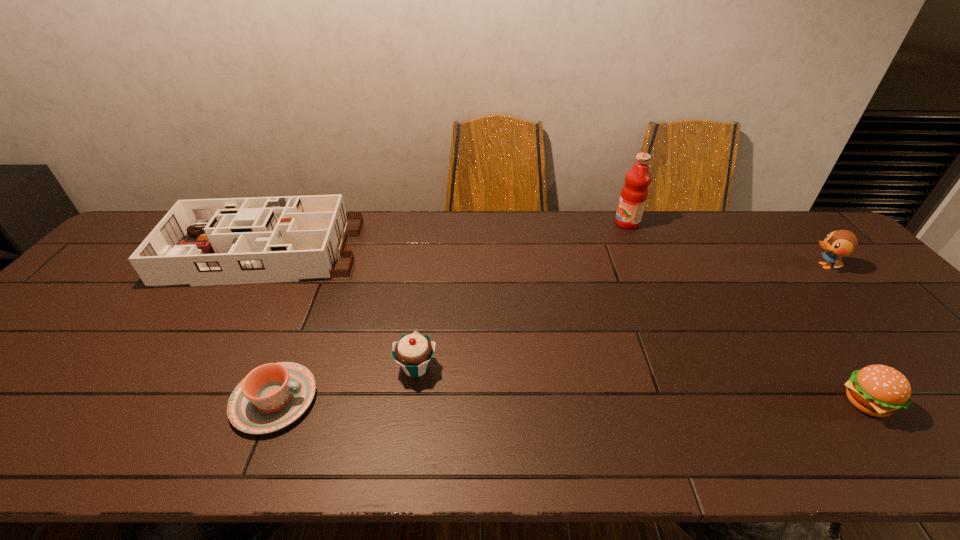
Image resolution: width=960 pixels, height=540 pixels. What are the coordinates of `fruit juice` in the screenshot? It's located at (634, 193).

The image size is (960, 540). Find the location of `the tallest object`. the tallest object is located at coordinates (634, 193).

You are a GUI agent. You are given a task and a screenshot of the screen. Output one action in this format:
    pyautogui.click(x=<x>, y=<y>)
    Task: Click on the rightmost object
    
    Given the screenshot: What is the action you would take?
    pyautogui.click(x=839, y=243)

Identify the location of dollhouse. This screenshot has width=960, height=540. (256, 240).

You are a GUI agent. You are given a task and a screenshot of the screen. Output one action in this format:
    pyautogui.click(x=<x>, y=<y>)
    Task: Click on the cupcake
    The image size is (960, 540).
    Given the screenshot: What is the action you would take?
    pyautogui.click(x=413, y=352)

Locate an element on the screen. This screenshot has height=540, width=960. the fifth object from left to right is located at coordinates (878, 390).

Find the location of a particular element. The image size is (960, 540). the shortest object is located at coordinates (272, 396).

Locate an element on the screen. The height and width of the screenshot is (540, 960). blank space located 0.160m on the front label of the fruit juice is located at coordinates click(566, 223).

Locate an element on the screen. This screenshot has height=540, width=960. vacant position located on the front label of the fruit juice is located at coordinates tap(545, 223).

Identify the location of free spot located on the front label of the fruit juice. (545, 223).